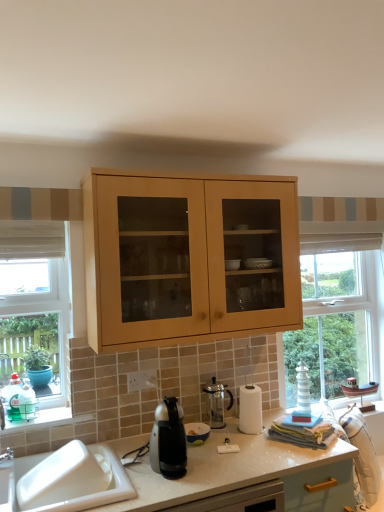
Question: Is matte black coffee maker at center, arranged as the first appliance when viewed from the front, positioned before wooden window frame at left?

Choices:
 (A) no
 (B) yes

Answer: (B)

Question: From the image's perspective, is matte black coffee maker at center, arranged as the first appliance when viewed from the front, under wooden window frame at left?

Choices:
 (A) yes
 (B) no

Answer: (A)

Question: Considering the relative sizes of matte black coffee maker at center, the second appliance viewed from the back, and wooden window frame at left in the image provided, is matte black coffee maker at center, the second appliance viewed from the back, smaller than wooden window frame at left?

Choices:
 (A) yes
 (B) no

Answer: (A)

Question: From a real-world perspective, is matte black coffee maker at center, arranged as the first appliance when viewed from the front, on wooden window frame at left?

Choices:
 (A) no
 (B) yes

Answer: (A)

Question: Is matte black coffee maker at center, arranged as the first appliance when viewed from the front, turned away from wooden window frame at left?

Choices:
 (A) no
 (B) yes

Answer: (A)

Question: Is matte black coffee maker at center, the second appliance viewed from the back, wider than wooden window frame at left?

Choices:
 (A) no
 (B) yes

Answer: (B)

Question: Is matte black coffee maker at center, the second appliance viewed from the back, oriented away from satin black coffee maker at center?

Choices:
 (A) no
 (B) yes

Answer: (A)

Question: From the image's perspective, would you say matte black coffee maker at center, the second appliance viewed from the back, is shown under satin black coffee maker at center?

Choices:
 (A) yes
 (B) no

Answer: (A)

Question: Is matte black coffee maker at center, arranged as the first appliance when viewed from the front, at the right side of satin black coffee maker at center?

Choices:
 (A) yes
 (B) no

Answer: (A)

Question: Is the position of matte black coffee maker at center, the second appliance viewed from the back, more distant than that of satin black coffee maker at center?

Choices:
 (A) no
 (B) yes

Answer: (B)

Question: Can you confirm if matte black coffee maker at center, the second appliance viewed from the back, is thinner than satin black coffee maker at center?

Choices:
 (A) yes
 (B) no

Answer: (A)

Question: Can you confirm if matte black coffee maker at center, arranged as the first appliance when viewed from the front, is bigger than satin black coffee maker at center?

Choices:
 (A) yes
 (B) no

Answer: (B)

Question: Does matte black coffee maker at center, the second appliance viewed from the back, have a larger size compared to clear glass coffee pot at center, which ranks as the first appliance in back-to-front order?

Choices:
 (A) yes
 (B) no

Answer: (B)